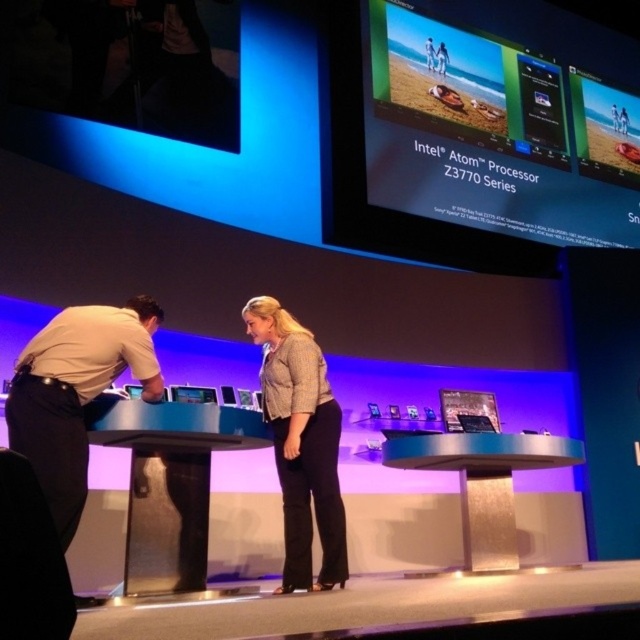
Is matte black screen at upper center wider than light gray textured blazer at center?

Yes, matte black screen at upper center is wider than light gray textured blazer at center.

Which is more to the left, matte black screen at upper center or light gray textured blazer at center?

Positioned to the left is light gray textured blazer at center.

At what (x,y) coordinates should I click in order to perform the action: click on matte black screen at upper center. Please return your answer as a coordinate pair (x, y). This screenshot has width=640, height=640. Looking at the image, I should click on (493, 134).

Who is taller, light gray textured blazer at center or matte black laptop at center?

light gray textured blazer at center

Is light gray textured blazer at center further to the viewer compared to matte black laptop at center?

That is False.

Who is more forward, (296, 499) or (451, 429)?

Point (296, 499) is in front.

This screenshot has width=640, height=640. In order to click on light gray textured blazer at center in this screenshot , I will do `click(300, 444)`.

Can you confirm if light beige shirt at left is positioned below matte black tablet at center?

Actually, light beige shirt at left is above matte black tablet at center.

Which is behind, point (52, 346) or point (192, 401)?

Positioned behind is point (192, 401).

Image resolution: width=640 pixels, height=640 pixels. I want to click on light beige shirt at left, so click(x=76, y=394).